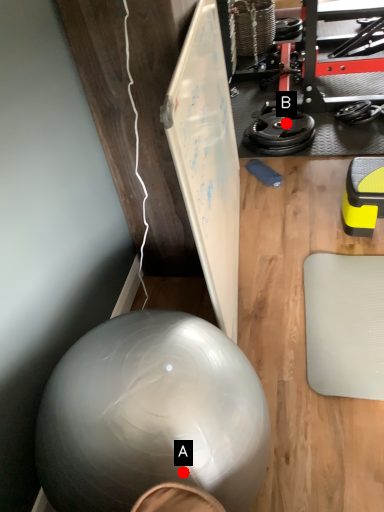
Question: Two points are circled on the image, labeled by A and B beside each circle. Which of the following is the farthest from the observer?

Choices:
 (A) A is further
 (B) B is further

Answer: (B)